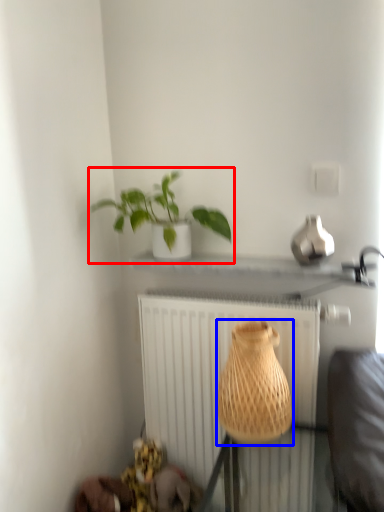
Question: Which object appears closest to the camera in this image, houseplant (highlighted by a red box) or vase (highlighted by a blue box)?

Choices:
 (A) houseplant
 (B) vase

Answer: (B)